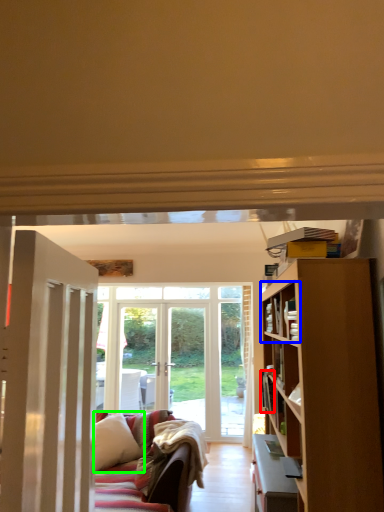
Question: Considering the real-world distances, which object is closest to book (highlighted by a red box)? shelf (highlighted by a blue box) or pillow (highlighted by a green box).

Choices:
 (A) shelf
 (B) pillow

Answer: (A)